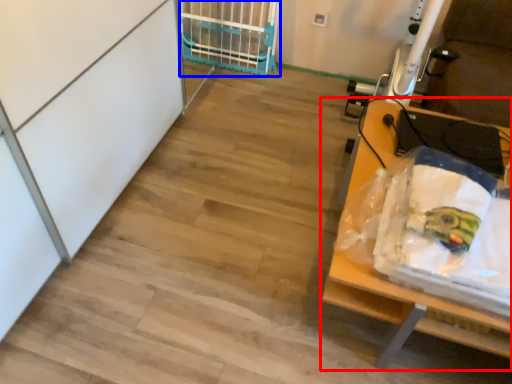
Question: Among these objects, which one is farthest to the camera, furniture (highlighted by a red box) or cage (highlighted by a blue box)?

Choices:
 (A) furniture
 (B) cage

Answer: (B)